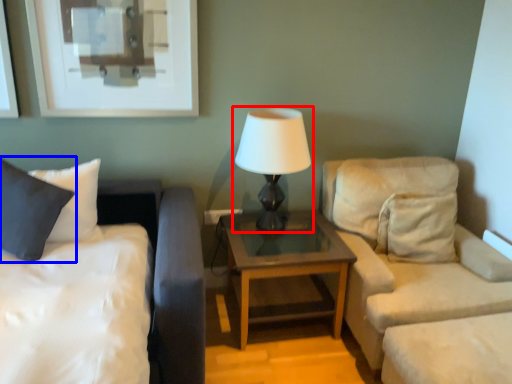
Question: Which object appears farthest to the camera in this image, lamp (highlighted by a red box) or pillow (highlighted by a blue box)?

Choices:
 (A) lamp
 (B) pillow

Answer: (A)